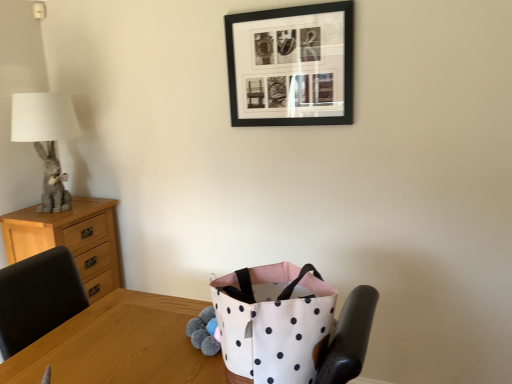
Question: Is gray plush rabbit at left situated inside black leather chair at left or outside?

Choices:
 (A) outside
 (B) inside

Answer: (A)

Question: In terms of height, does gray plush rabbit at left look taller or shorter compared to black leather chair at left?

Choices:
 (A) tall
 (B) short

Answer: (A)

Question: Which is farther from the black matte picture frame at upper center?

Choices:
 (A) light wood chest of drawers at left
 (B) white polka dot fabric shopping bag at center
 (C) gray plush rabbit at left
 (D) white fabric bag at center
 (E) black leather chair at left

Answer: (E)

Question: Estimate the real-world distances between objects in this image. Which object is farther from the white polka dot fabric shopping bag at center?

Choices:
 (A) light wood chest of drawers at left
 (B) black leather chair at left
 (C) white fabric bag at center
 (D) gray plush rabbit at left
 (E) black matte picture frame at upper center

Answer: (D)